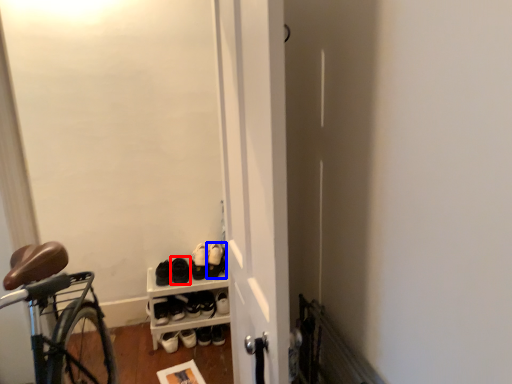
Question: Among these objects, which one is farthest to the camera, footwear (highlighted by a red box) or footwear (highlighted by a blue box)?

Choices:
 (A) footwear
 (B) footwear

Answer: (B)